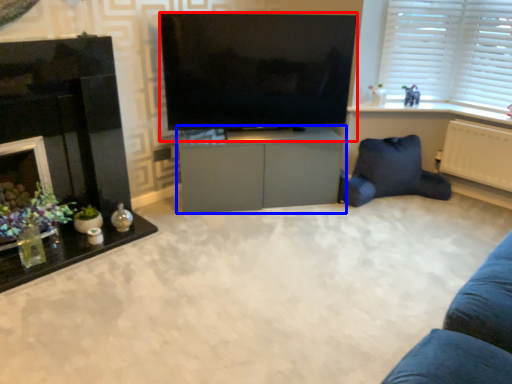
Question: Which object appears farthest to the camera in this image, television (highlighted by a red box) or cabinetry (highlighted by a blue box)?

Choices:
 (A) television
 (B) cabinetry

Answer: (B)